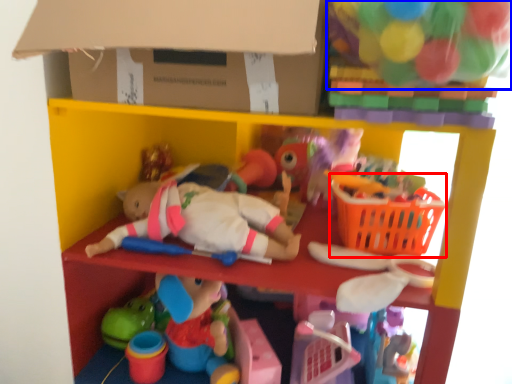
Question: Which of the following is the farthest to the observer, basket (highlighted by a red box) or toy (highlighted by a blue box)?

Choices:
 (A) basket
 (B) toy

Answer: (A)